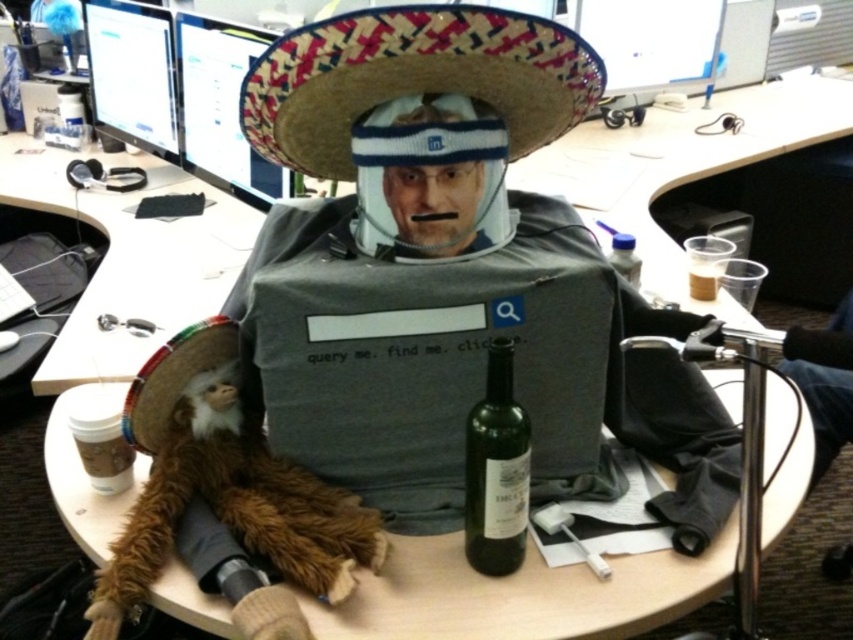
Question: Estimate the real-world distances between objects in this image. Which object is farther from the clear plastic bottle at upper right?

Choices:
 (A) green glass bottle at center
 (B) woven straw sombrero at center
 (C) brown plush monkey at lower left

Answer: (C)

Question: Which point is farther to the camera?

Choices:
 (A) brown plush monkey at lower left
 (B) green glass bottle at center

Answer: (B)

Question: Can you confirm if woven straw sombrero at center is thinner than clear plastic bottle at upper right?

Choices:
 (A) yes
 (B) no

Answer: (B)

Question: In this image, where is brown plush monkey at lower left located relative to clear plastic bottle at upper right?

Choices:
 (A) above
 (B) below

Answer: (B)

Question: Among these objects, which one is nearest to the camera?

Choices:
 (A) brown plush monkey at lower left
 (B) woven straw sombrero at center

Answer: (B)

Question: Is brown plush monkey at lower left to the right of clear plastic bottle at upper right from the viewer's perspective?

Choices:
 (A) yes
 (B) no

Answer: (B)